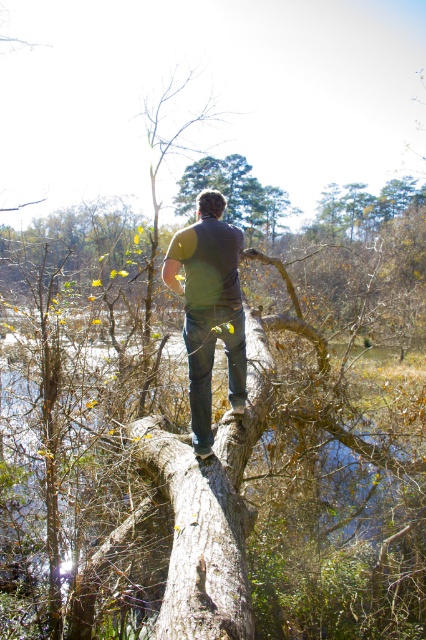
Question: Which of the following is the closest to the observer?

Choices:
 (A) smooth brown log at center
 (B) dark gray shirt at center

Answer: (A)

Question: Is smooth brown log at center positioned in front of dark gray shirt at center?

Choices:
 (A) yes
 (B) no

Answer: (A)

Question: Does smooth brown log at center have a smaller size compared to dark gray shirt at center?

Choices:
 (A) no
 (B) yes

Answer: (A)

Question: Is smooth brown log at center to the left of dark gray shirt at center from the viewer's perspective?

Choices:
 (A) yes
 (B) no

Answer: (A)

Question: Which point appears closest to the camera in this image?

Choices:
 (A) (172, 269)
 (B) (212, 536)

Answer: (B)